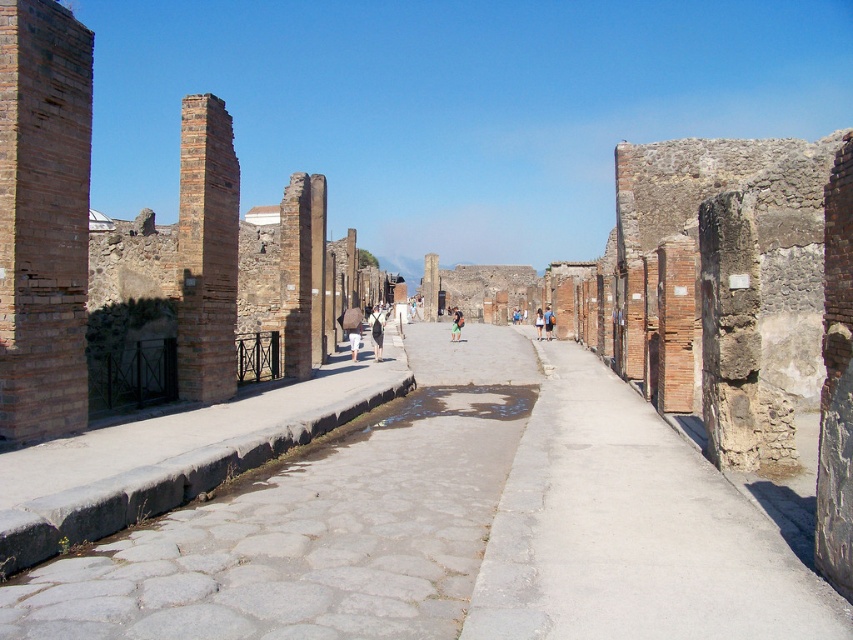
You are a fashion designer observing two garments in a historical Roman street scene. You see a white cotton shirt at center and a blue fabric dress at center. Which garment has a greater width when viewed from the front?

The white cotton shirt at center might be wider than blue fabric dress at center, so it is possible that the white cotton shirt at center has a greater width when viewed from the front.

You are a tourist visiting the ancient Roman street in Pompeii. You see a white cotton shirt at center. Where is the white cotton shirt located in the scene?

The white cotton shirt at center is located at the center of the scene, at the coordinates point (376, 332).

You are a tourist visiting Pompeii and want to take a photo of the brown brick pillar at left and the blue fabric dress at center in the same frame. Based on their distance, can you fit both in your camera viewfinder?

The brown brick pillar at left and blue fabric dress at center are 84.92 meters apart from each other, so it is possible to fit both in the camera viewfinder as they are far apart but within a straight path.